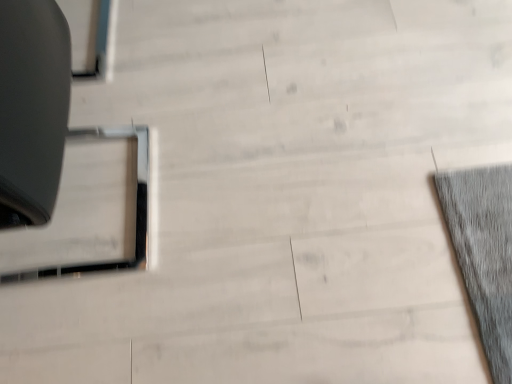
Where is `matte black chair at left`? The image size is (512, 384). matte black chair at left is located at coordinates (61, 161).

Describe the element at coordinates (61, 161) in the screenshot. The image size is (512, 384). I see `matte black chair at left` at that location.

Locate an element on the screen. The width and height of the screenshot is (512, 384). matte black chair at left is located at coordinates (61, 161).